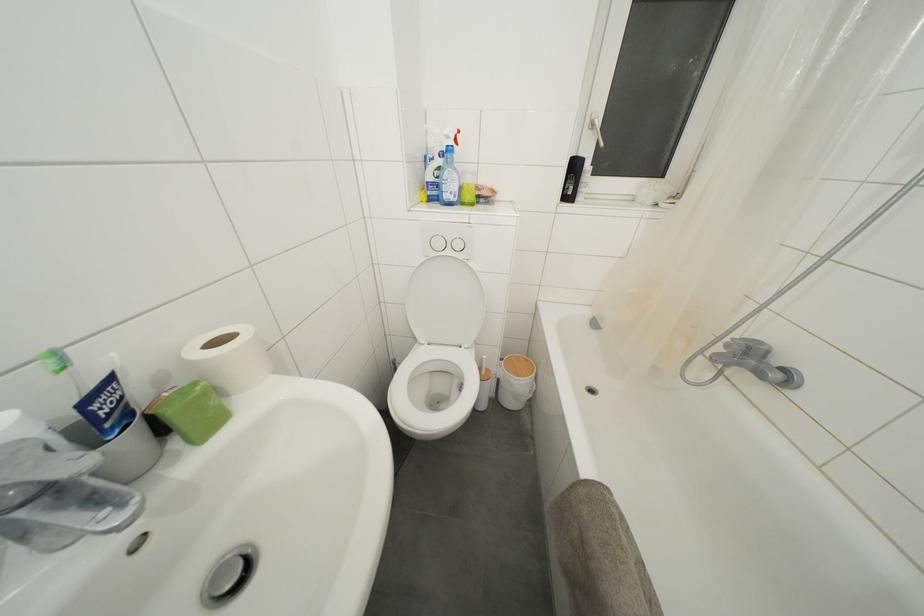
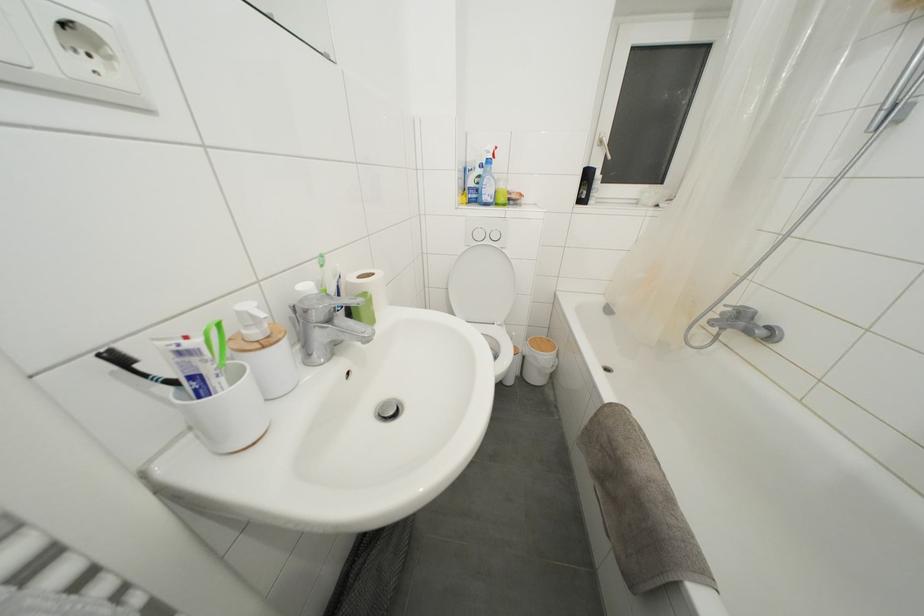
Find the pixel in the second image that matches (521,362) in the first image.

(544, 342)